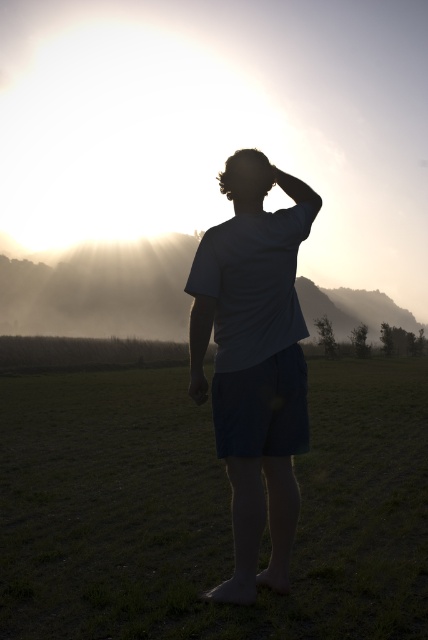
Question: Is green grass at center to the left of gray cotton shirt at center from the viewer's perspective?

Choices:
 (A) yes
 (B) no

Answer: (B)

Question: Which of the following is the closest to the observer?

Choices:
 (A) green grass at center
 (B) gray cotton shirt at center

Answer: (A)

Question: Which object appears closest to the camera in this image?

Choices:
 (A) green grass at center
 (B) gray cotton shirt at center

Answer: (A)

Question: Does green grass at center have a smaller size compared to gray cotton shirt at center?

Choices:
 (A) no
 (B) yes

Answer: (A)

Question: From the image, what is the correct spatial relationship of green grass at center in relation to gray cotton shirt at center?

Choices:
 (A) below
 (B) above

Answer: (A)